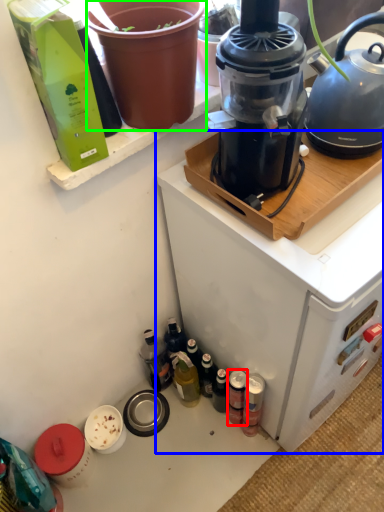
Question: Which is farther away from bottle (highlighted by a red box)? appliance (highlighted by a blue box) or flowerpot (highlighted by a green box)?

Choices:
 (A) appliance
 (B) flowerpot

Answer: (B)